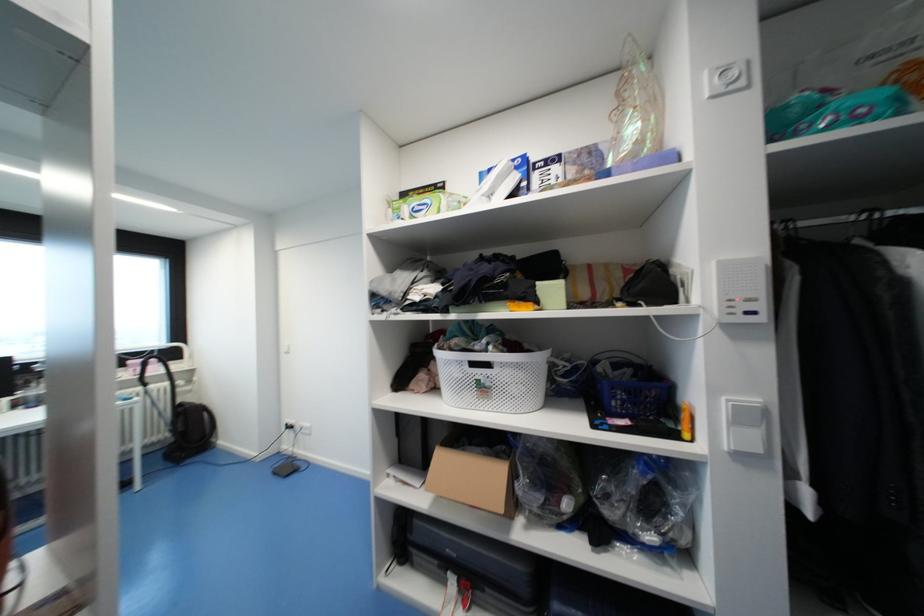
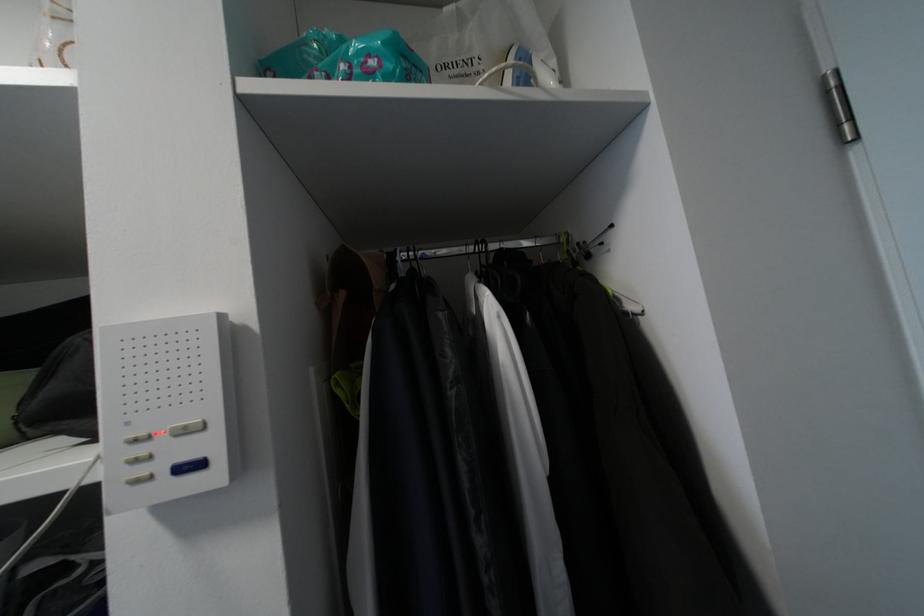
The point at (x=867, y=111) is marked in the first image. Where is the corresponding point in the second image?

(377, 63)